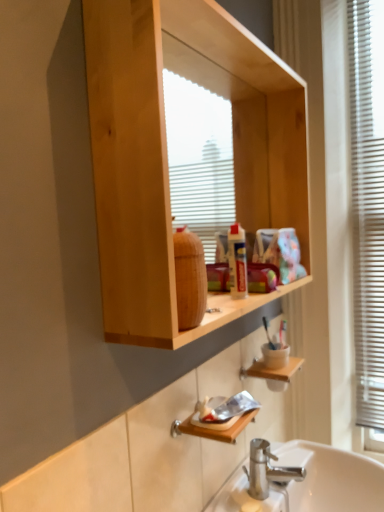
Question: Does wooden shelf at lower center have a greater height compared to white plastic blinds at right?

Choices:
 (A) no
 (B) yes

Answer: (A)

Question: Is wooden shelf at lower center shorter than white plastic blinds at right?

Choices:
 (A) no
 (B) yes

Answer: (B)

Question: From the image's perspective, does wooden shelf at lower center appear higher than white plastic blinds at right?

Choices:
 (A) no
 (B) yes

Answer: (A)

Question: From a real-world perspective, is wooden shelf at lower center over white plastic blinds at right?

Choices:
 (A) yes
 (B) no

Answer: (B)

Question: From the image's perspective, is wooden shelf at lower center under white plastic blinds at right?

Choices:
 (A) yes
 (B) no

Answer: (A)

Question: Could you tell me if wooden shelf at lower center is facing white plastic blinds at right?

Choices:
 (A) yes
 (B) no

Answer: (B)

Question: Is natural wood cabinet at upper center bigger than white plastic blinds at right?

Choices:
 (A) no
 (B) yes

Answer: (B)

Question: From a real-world perspective, is natural wood cabinet at upper center positioned under white plastic blinds at right based on gravity?

Choices:
 (A) no
 (B) yes

Answer: (A)

Question: From the image's perspective, is natural wood cabinet at upper center located above white plastic blinds at right?

Choices:
 (A) yes
 (B) no

Answer: (A)

Question: Does natural wood cabinet at upper center have a greater height compared to white plastic blinds at right?

Choices:
 (A) yes
 (B) no

Answer: (B)

Question: From the image's perspective, is natural wood cabinet at upper center under white plastic blinds at right?

Choices:
 (A) no
 (B) yes

Answer: (A)

Question: Is natural wood cabinet at upper center not inside white plastic blinds at right?

Choices:
 (A) yes
 (B) no

Answer: (A)

Question: Is white plastic blinds at right not inside natural wood cabinet at upper center?

Choices:
 (A) no
 (B) yes

Answer: (B)